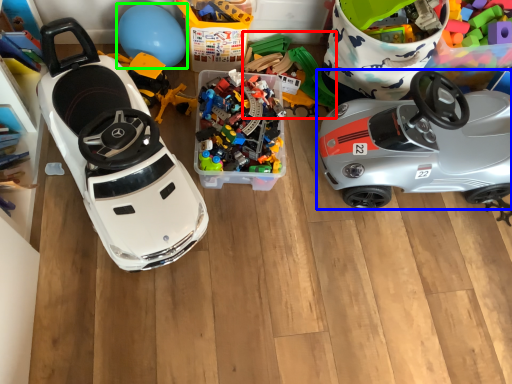
Question: Based on their relative distances, which object is farther from toy (highlighted by a red box)? Choose from car (highlighted by a blue box) and balloon (highlighted by a green box).

Choices:
 (A) car
 (B) balloon

Answer: (B)